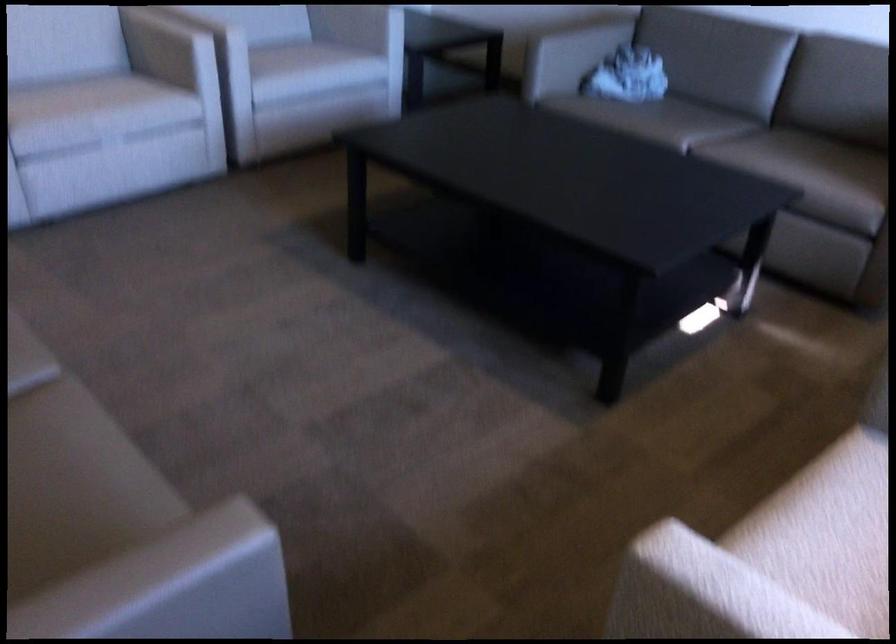
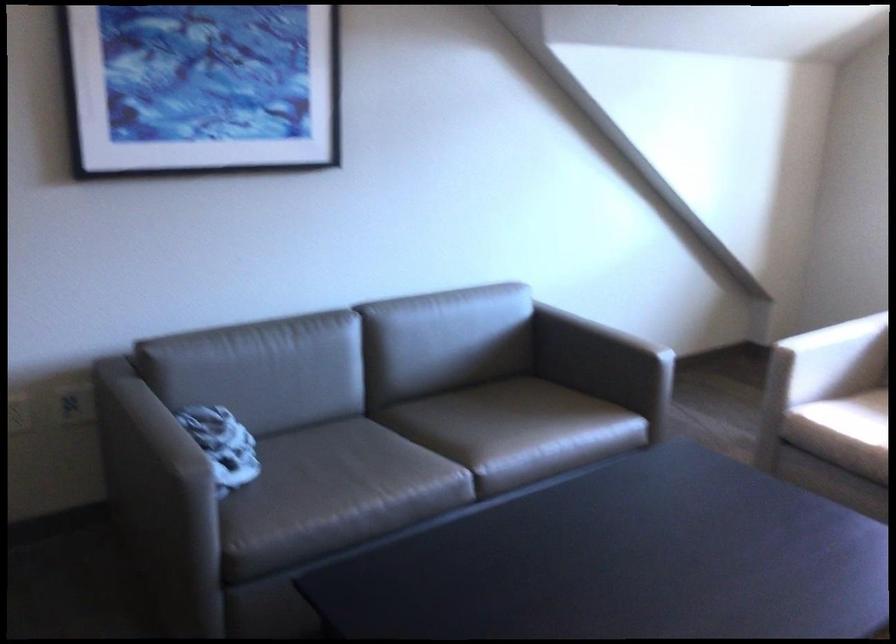
In the second image, find the point that corresponds to pixel 764 149 in the first image.

(497, 430)